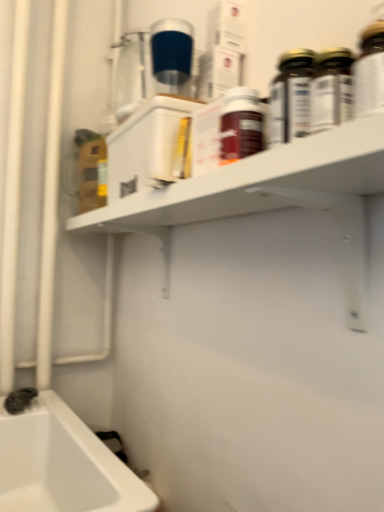
Question: Is black rubber faucet at lower left bigger than gold metallic bottle at upper right, positioned as the 1th bottle in right-to-left order?

Choices:
 (A) yes
 (B) no

Answer: (B)

Question: From the image's perspective, is black rubber faucet at lower left above gold metallic bottle at upper right, the 2th bottle from the bottom?

Choices:
 (A) no
 (B) yes

Answer: (A)

Question: Is black rubber faucet at lower left closer to camera compared to gold metallic bottle at upper right, which appears as the 1th bottle when viewed from the back?

Choices:
 (A) no
 (B) yes

Answer: (A)

Question: Does black rubber faucet at lower left appear on the right side of gold metallic bottle at upper right, the 2th bottle in the left-to-right sequence?

Choices:
 (A) no
 (B) yes

Answer: (A)

Question: Is black rubber faucet at lower left next to gold metallic bottle at upper right, the 2th bottle from the bottom, and touching it?

Choices:
 (A) yes
 (B) no

Answer: (B)

Question: Is white matte shelf at upper center wider or thinner than black rubber faucet at lower left?

Choices:
 (A) thin
 (B) wide

Answer: (B)

Question: Relative to black rubber faucet at lower left, is white matte shelf at upper center in front or behind?

Choices:
 (A) behind
 (B) front

Answer: (B)

Question: From the image's perspective, is white matte shelf at upper center positioned above or below black rubber faucet at lower left?

Choices:
 (A) above
 (B) below

Answer: (A)

Question: Considering the positions of white matte shelf at upper center and black rubber faucet at lower left in the image, is white matte shelf at upper center bigger or smaller than black rubber faucet at lower left?

Choices:
 (A) big
 (B) small

Answer: (A)

Question: From a real-world perspective, is white matte shelf at upper center above or below gold metallic bottle at upper right, the 2th bottle when ordered from front to back?

Choices:
 (A) above
 (B) below

Answer: (B)

Question: Considering the positions of white matte shelf at upper center and gold metallic bottle at upper right, arranged as the first bottle when viewed from the top, in the image, is white matte shelf at upper center taller or shorter than gold metallic bottle at upper right, arranged as the first bottle when viewed from the top,?

Choices:
 (A) tall
 (B) short

Answer: (A)

Question: Would you say white matte shelf at upper center is to the left or to the right of gold metallic bottle at upper right, the 2th bottle when ordered from front to back, in the picture?

Choices:
 (A) right
 (B) left

Answer: (B)

Question: Considering the positions of point (336, 204) and point (306, 65), is point (336, 204) closer or farther from the camera than point (306, 65)?

Choices:
 (A) farther
 (B) closer

Answer: (A)

Question: From the image's perspective, is white matte shelf at upper center located above or below matte brown bottle at center, which is the first bottle in bottom-to-top order?

Choices:
 (A) above
 (B) below

Answer: (B)

Question: Is white matte shelf at upper center to the left or to the right of matte brown bottle at center, which is the first bottle in bottom-to-top order, in the image?

Choices:
 (A) right
 (B) left

Answer: (B)